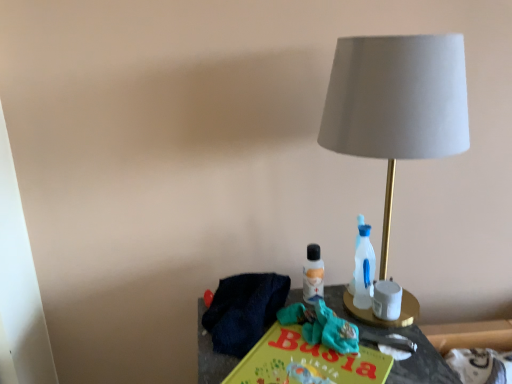
Question: Considering the relative positions of matte gray fabric lampshade at right and yellow matte paper at center in the image provided, is matte gray fabric lampshade at right behind yellow matte paper at center?

Choices:
 (A) yes
 (B) no

Answer: (A)

Question: Is matte gray fabric lampshade at right outside yellow matte paper at center?

Choices:
 (A) yes
 (B) no

Answer: (A)

Question: Does matte gray fabric lampshade at right have a greater height compared to yellow matte paper at center?

Choices:
 (A) yes
 (B) no

Answer: (A)

Question: Is the position of matte gray fabric lampshade at right less distant than that of yellow matte paper at center?

Choices:
 (A) yes
 (B) no

Answer: (B)

Question: Can you confirm if matte gray fabric lampshade at right is shorter than yellow matte paper at center?

Choices:
 (A) no
 (B) yes

Answer: (A)

Question: Does matte gray fabric lampshade at right have a lesser width compared to yellow matte paper at center?

Choices:
 (A) no
 (B) yes

Answer: (B)

Question: Is yellow matte paper at center turned away from teal fabric scrub at center?

Choices:
 (A) no
 (B) yes

Answer: (A)

Question: From the image's perspective, is yellow matte paper at center above teal fabric scrub at center?

Choices:
 (A) no
 (B) yes

Answer: (A)

Question: From the image's perspective, does yellow matte paper at center appear lower than teal fabric scrub at center?

Choices:
 (A) no
 (B) yes

Answer: (B)

Question: Is teal fabric scrub at center located within yellow matte paper at center?

Choices:
 (A) no
 (B) yes

Answer: (A)

Question: Are yellow matte paper at center and teal fabric scrub at center making contact?

Choices:
 (A) no
 (B) yes

Answer: (B)

Question: Is yellow matte paper at center to the left of teal fabric scrub at center from the viewer's perspective?

Choices:
 (A) no
 (B) yes

Answer: (B)

Question: Is white matte candle holder at right turned away from teal fabric scrub at center?

Choices:
 (A) yes
 (B) no

Answer: (B)